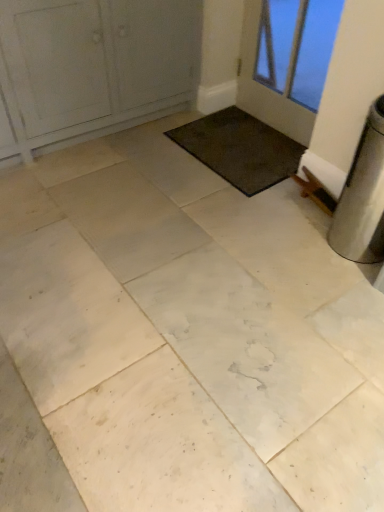
Question: From the image's perspective, does white painted wood door at upper left, the first door positioned from the left, appear higher than white glass door at upper right, which is the 2th door in left-to-right order?

Choices:
 (A) no
 (B) yes

Answer: (B)

Question: Considering the relative sizes of white painted wood door at upper left, the first door positioned from the left, and white glass door at upper right, the first door from the right, in the image provided, is white painted wood door at upper left, the first door positioned from the left, thinner than white glass door at upper right, the first door from the right,?

Choices:
 (A) yes
 (B) no

Answer: (B)

Question: Is white painted wood door at upper left, the first door positioned from the left, facing away from white glass door at upper right, which is the 2th door in left-to-right order?

Choices:
 (A) no
 (B) yes

Answer: (A)

Question: Would you say white painted wood door at upper left, acting as the 2th door starting from the right, is outside white glass door at upper right, which is the 2th door in left-to-right order?

Choices:
 (A) no
 (B) yes

Answer: (B)

Question: Does white painted wood door at upper left, the first door positioned from the left, lie behind white glass door at upper right, which is the 2th door in left-to-right order?

Choices:
 (A) yes
 (B) no

Answer: (B)

Question: Can you confirm if white painted wood door at upper left, the first door positioned from the left, is shorter than white glass door at upper right, which is the 2th door in left-to-right order?

Choices:
 (A) yes
 (B) no

Answer: (B)

Question: Is white glass door at upper right, the first door from the right, wider than white painted wood door at upper left, the first door positioned from the left?

Choices:
 (A) yes
 (B) no

Answer: (B)

Question: From a real-world perspective, is white glass door at upper right, which is the 2th door in left-to-right order, on white painted wood door at upper left, acting as the 2th door starting from the right?

Choices:
 (A) no
 (B) yes

Answer: (A)

Question: Is white glass door at upper right, which is the 2th door in left-to-right order, at the left side of white painted wood door at upper left, the first door positioned from the left?

Choices:
 (A) yes
 (B) no

Answer: (B)

Question: Are white glass door at upper right, which is the 2th door in left-to-right order, and white painted wood door at upper left, the first door positioned from the left, beside each other?

Choices:
 (A) yes
 (B) no

Answer: (B)

Question: Is white glass door at upper right, the first door from the right, thinner than white painted wood door at upper left, the first door positioned from the left?

Choices:
 (A) no
 (B) yes

Answer: (B)

Question: From the image's perspective, is white glass door at upper right, which is the 2th door in left-to-right order, below white painted wood door at upper left, acting as the 2th door starting from the right?

Choices:
 (A) no
 (B) yes

Answer: (B)

Question: Is dark brown carpet at center surrounding white glass door at upper right, the first door from the right?

Choices:
 (A) yes
 (B) no

Answer: (B)